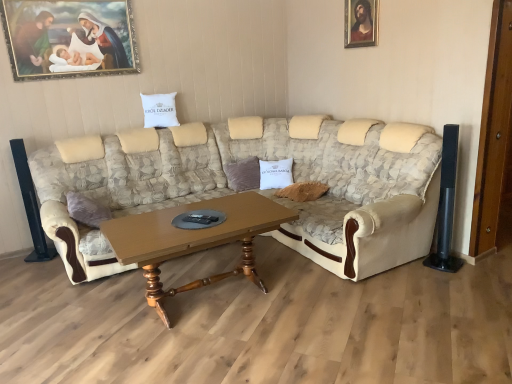
Question: Considering the relative positions of gold-framed painting at upper left, acting as the second picture frame starting from the right, and white cotton pillow at center, the first pillow from the top, in the image provided, is gold-framed painting at upper left, acting as the second picture frame starting from the right, to the right of white cotton pillow at center, the first pillow from the top, from the viewer's perspective?

Choices:
 (A) no
 (B) yes

Answer: (A)

Question: Does gold-framed painting at upper left, marked as the 1th picture frame in a left-to-right arrangement, have a lesser width compared to white cotton pillow at center, the first pillow from the top?

Choices:
 (A) yes
 (B) no

Answer: (A)

Question: From the image's perspective, is gold-framed painting at upper left, marked as the 1th picture frame in a left-to-right arrangement, located above white cotton pillow at center, the first pillow from the top?

Choices:
 (A) no
 (B) yes

Answer: (B)

Question: Is gold-framed painting at upper left, marked as the 1th picture frame in a left-to-right arrangement, looking in the opposite direction of white cotton pillow at center, which ranks as the 1th pillow in left-to-right order?

Choices:
 (A) yes
 (B) no

Answer: (B)

Question: From a real-world perspective, is gold-framed painting at upper left, marked as the 1th picture frame in a left-to-right arrangement, positioned over white cotton pillow at center, which is counted as the second pillow, starting from the bottom, based on gravity?

Choices:
 (A) no
 (B) yes

Answer: (B)

Question: Is brown wooden coffee table at center taller or shorter than wooden framed portrait at upper right, arranged as the first picture frame when viewed from the right?

Choices:
 (A) short
 (B) tall

Answer: (B)

Question: Based on their sizes in the image, would you say brown wooden coffee table at center is bigger or smaller than wooden framed portrait at upper right, arranged as the first picture frame when viewed from the right?

Choices:
 (A) big
 (B) small

Answer: (A)

Question: From the image's perspective, is brown wooden coffee table at center located above or below wooden framed portrait at upper right, which is counted as the second picture frame, starting from the left?

Choices:
 (A) above
 (B) below

Answer: (B)

Question: Choose the correct answer: Is brown wooden coffee table at center inside wooden framed portrait at upper right, which is counted as the second picture frame, starting from the left, or outside it?

Choices:
 (A) outside
 (B) inside

Answer: (A)

Question: Relative to brown wooden coffee table at center, is beige fabric couch at center in front or behind?

Choices:
 (A) front
 (B) behind

Answer: (A)

Question: Based on their positions, is beige fabric couch at center located to the left or right of brown wooden coffee table at center?

Choices:
 (A) left
 (B) right

Answer: (B)

Question: Does point (297, 158) appear closer or farther from the camera than point (249, 276)?

Choices:
 (A) closer
 (B) farther

Answer: (B)

Question: From a real-world perspective, relative to brown wooden coffee table at center, is beige fabric couch at center vertically above or below?

Choices:
 (A) below
 (B) above

Answer: (B)

Question: Considering the relative positions of brown wooden coffee table at center and white cotton pillow at center, which is counted as the second pillow, starting from the bottom, in the image provided, is brown wooden coffee table at center to the left or to the right of white cotton pillow at center, which is counted as the second pillow, starting from the bottom,?

Choices:
 (A) right
 (B) left

Answer: (A)

Question: Considering the positions of brown wooden coffee table at center and white cotton pillow at center, marked as the second pillow in a right-to-left arrangement, in the image, is brown wooden coffee table at center wider or thinner than white cotton pillow at center, marked as the second pillow in a right-to-left arrangement,?

Choices:
 (A) wide
 (B) thin

Answer: (A)